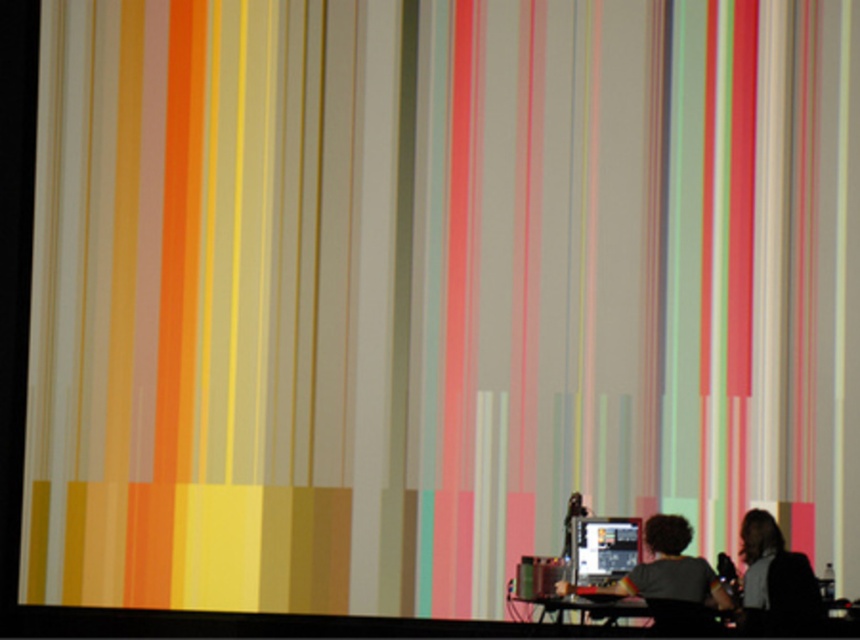
Which of these two, dark brown hair at lower right or matte black monitor at lower center, stands shorter?

matte black monitor at lower center is shorter.

Who is more forward, (741, 548) or (624, 540)?

Positioned in front is point (624, 540).

Between point (762, 612) and point (636, 550), which one is positioned behind?

The point (636, 550) is more distant.

Find the location of a particular element. dark brown hair at lower right is located at coordinates (777, 580).

Is matte black computer at lower center positioned in front of black plastic table at lower center?

Yes, matte black computer at lower center is in front of black plastic table at lower center.

Can you confirm if matte black computer at lower center is positioned below black plastic table at lower center?

No, matte black computer at lower center is not below black plastic table at lower center.

What do you see at coordinates (665, 570) in the screenshot? Image resolution: width=860 pixels, height=640 pixels. I see `matte black computer at lower center` at bounding box center [665, 570].

Where is `matte black computer at lower center`? matte black computer at lower center is located at coordinates (665, 570).

Is matte black monitor at lower center above black plastic table at lower center?

Yes, matte black monitor at lower center is above black plastic table at lower center.

This screenshot has width=860, height=640. Describe the element at coordinates (603, 548) in the screenshot. I see `matte black monitor at lower center` at that location.

Identify the location of matte black monitor at lower center. (603, 548).